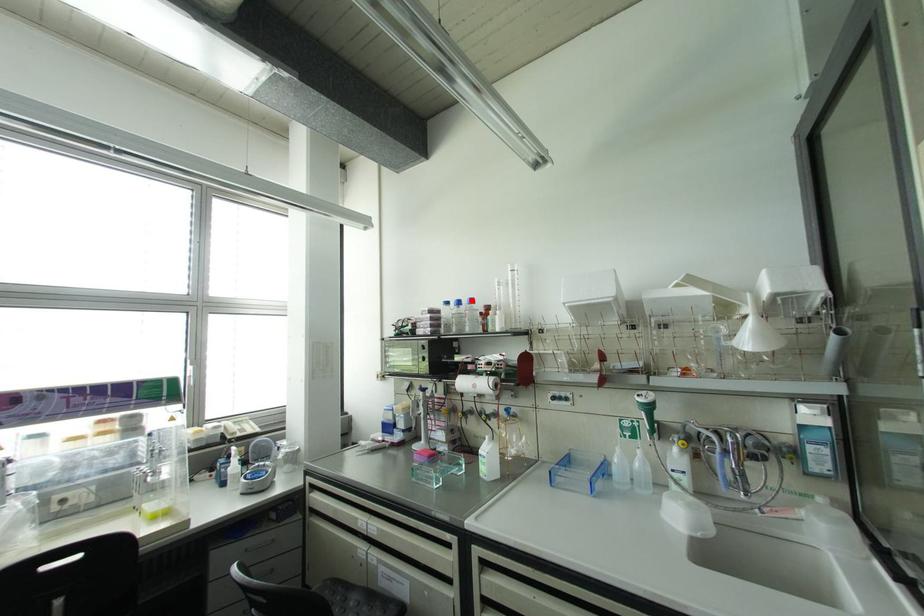
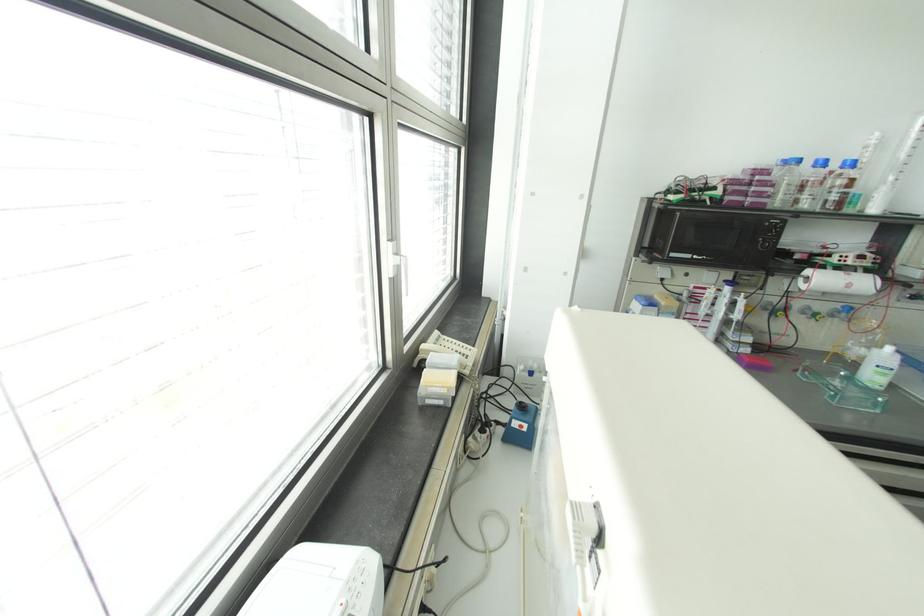
Where in the second image is the point corresponding to the highlighted location from the first image?

(852, 163)